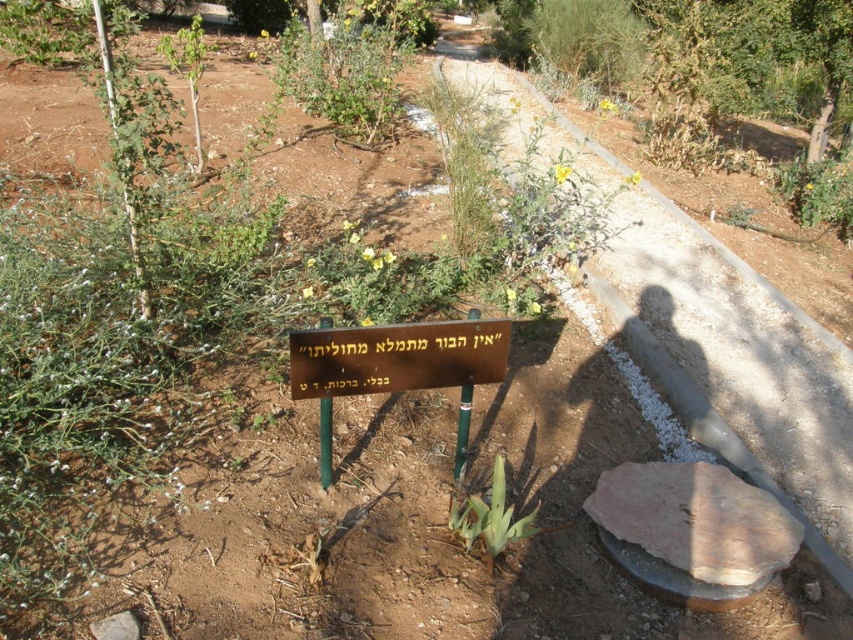
Between point (495, 365) and point (485, 516), which one is positioned in front?

Positioned in front is point (485, 516).

Is point (366, 326) closer to camera compared to point (485, 560)?

Yes.

Who is more distant from viewer, (332, 330) or (537, 529)?

Positioned behind is point (537, 529).

This screenshot has width=853, height=640. What are the coordinates of `brown polished sign at center` in the screenshot? It's located at (397, 356).

In order to click on yellow-green leafy plant at center in this screenshot , I will do `click(379, 280)`.

Is point (349, 321) more distant than point (851, 218)?

No, (349, 321) is in front of (851, 218).

Where is `yellow-green leafy plant at center`? This screenshot has width=853, height=640. yellow-green leafy plant at center is located at coordinates (379, 280).

Measure the distance from bronze metallic sign at center to green leafy plant at center.

bronze metallic sign at center is 13.31 inches away from green leafy plant at center.

Does bronze metallic sign at center come behind green leafy plant at center?

That is False.

Between point (306, 332) and point (473, 513), which one is positioned in front?

Point (306, 332)

Locate an element on the screen. The height and width of the screenshot is (640, 853). bronze metallic sign at center is located at coordinates (396, 368).